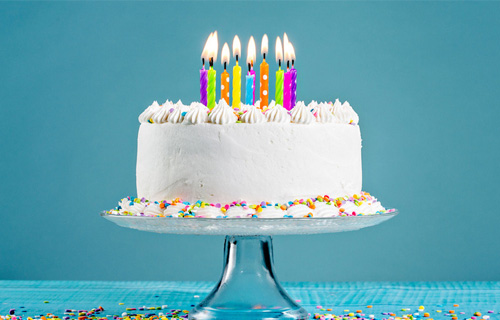
In order to click on birthday candles in this screenshot , I will do `click(293, 85)`, `click(288, 86)`, `click(280, 87)`, `click(264, 87)`, `click(252, 76)`, `click(250, 90)`, `click(237, 93)`, `click(226, 89)`, `click(212, 88)`, `click(204, 87)`.